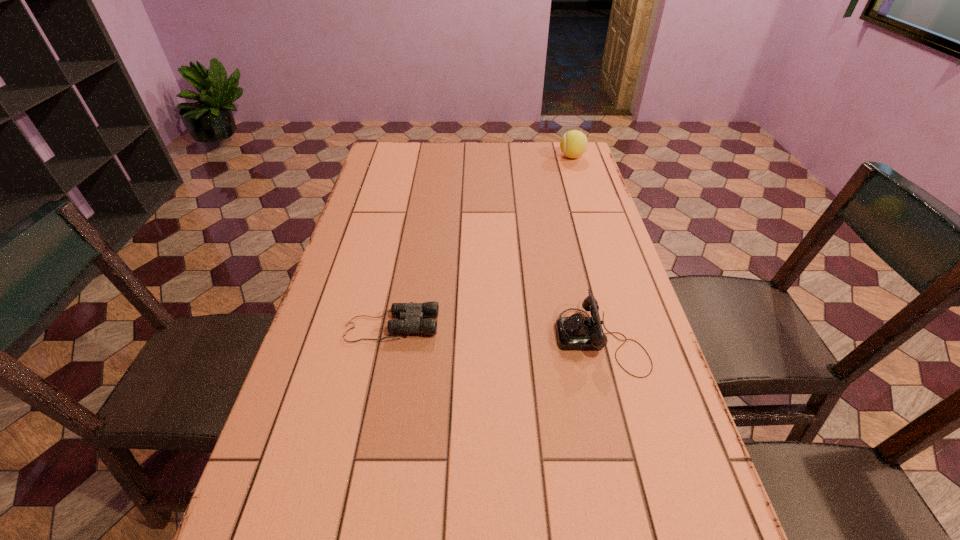
This screenshot has width=960, height=540. What are the coordinates of `object positioned at the far edge` in the screenshot? It's located at (573, 144).

Locate an element on the screen. The height and width of the screenshot is (540, 960). object located at the left edge is located at coordinates (413, 313).

At what (x,y) coordinates should I click in order to perform the action: click on tennis ball at the right edge. Please return your answer as a coordinate pair (x, y). The width and height of the screenshot is (960, 540). Looking at the image, I should click on (573, 144).

Where is `telephone present at the right edge`? telephone present at the right edge is located at coordinates (576, 332).

Where is `object situated at the far right corner`? The width and height of the screenshot is (960, 540). object situated at the far right corner is located at coordinates (573, 144).

This screenshot has height=540, width=960. Find the location of `vacant space at the far edge`. vacant space at the far edge is located at coordinates (x=453, y=159).

You are a GUI agent. You are given a task and a screenshot of the screen. Output one action in this format:
    pyautogui.click(x=<x>, y=<y>)
    Task: Click on the blank space at the left edge of the desktop
    
    Given the screenshot: What is the action you would take?
    pyautogui.click(x=351, y=315)

You are a GUI agent. You are given a task and a screenshot of the screen. Output one action in this format:
    pyautogui.click(x=<x>, y=<y>)
    Task: Click on the vacant area at the right edge
    This screenshot has width=960, height=540.
    Given the screenshot: What is the action you would take?
    pyautogui.click(x=581, y=265)

I want to click on free space at the far left corner of the desktop, so click(x=382, y=157).

Locate an element on the screen. vacant space at the far right corner of the desktop is located at coordinates (542, 152).